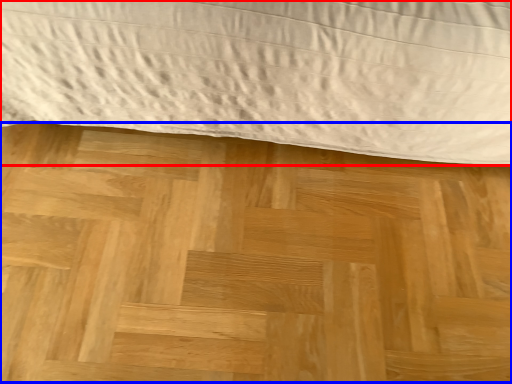
Question: Which of the following is the farthest to the observer, bed (highlighted by a red box) or plywood (highlighted by a blue box)?

Choices:
 (A) bed
 (B) plywood

Answer: (B)